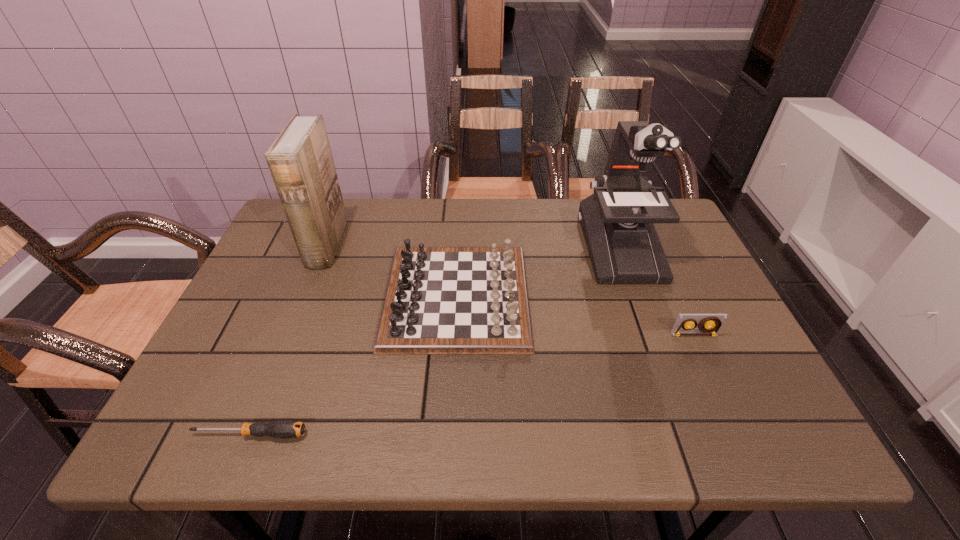
Identify the location of microscope. This screenshot has height=540, width=960. (617, 220).

Find the location of a particular element. The width and height of the screenshot is (960, 540). phonebook is located at coordinates (300, 161).

The width and height of the screenshot is (960, 540). I want to click on chessboard, so click(x=439, y=300).

I want to click on the third tallest object, so click(x=439, y=300).

You are a GUI agent. You are given a task and a screenshot of the screen. Output one action in this format:
    pyautogui.click(x=<x>, y=<y>)
    Task: Click on the videotape
    
    Given the screenshot: What is the action you would take?
    pyautogui.click(x=710, y=324)

Where is `the nearest object`? The width and height of the screenshot is (960, 540). the nearest object is located at coordinates (283, 429).

Locate an element on the screen. The width and height of the screenshot is (960, 540). screwdriver is located at coordinates (283, 429).

Where is `free space located through the eyepieces of the microscope`? free space located through the eyepieces of the microscope is located at coordinates (674, 397).

Identify the location of free spot located 0.160m on the cover of the phonebook. This screenshot has height=540, width=960. (396, 245).

Locate an element on the screen. The height and width of the screenshot is (540, 960). vacant area located 0.300m from the player's perspective of the chessboard is located at coordinates (648, 297).